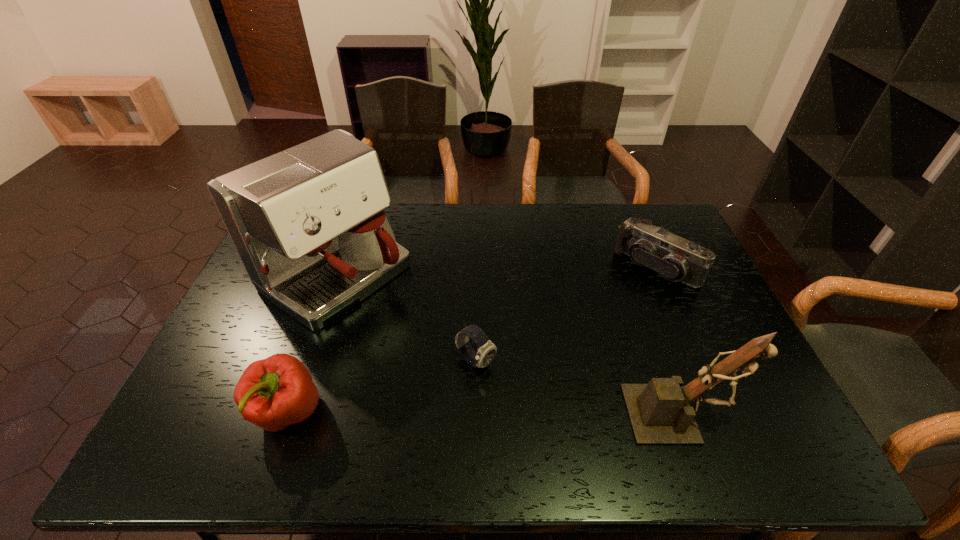
Image resolution: width=960 pixels, height=540 pixels. Find the location of `vacant space on the desktop that is between the bell pepper and the fourth shortest object and is positioned on the front-facing side of the camcorder`. vacant space on the desktop that is between the bell pepper and the fourth shortest object and is positioned on the front-facing side of the camcorder is located at coordinates (505, 413).

This screenshot has height=540, width=960. I want to click on vacant space on the desktop that is between the bell pepper and the figurine and is positioned on the front of the coffee maker near the spout, so click(x=533, y=414).

Locate an element on the screen. This screenshot has width=960, height=540. free spot on the desktop that is between the bell pepper and the figurine and is positioned on the face of the shortest object is located at coordinates (541, 414).